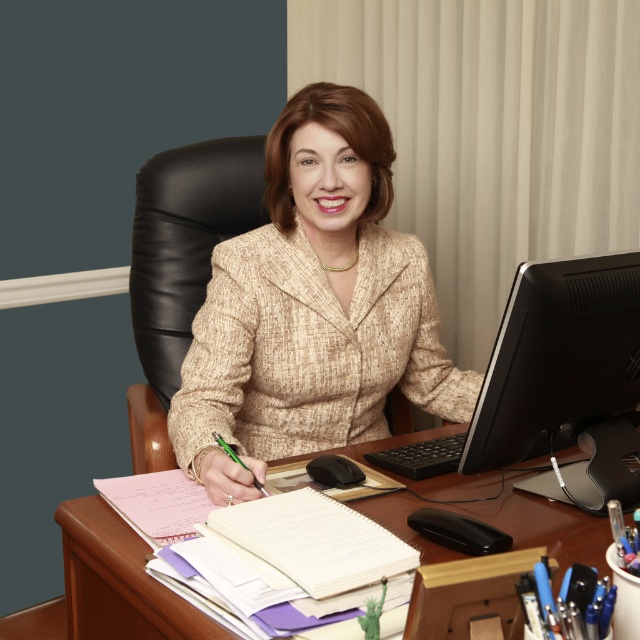
You are an office assistant who needs to organize the desk. The beige textured suit at center and wooden at center are both on the desk. Which item is located to the left of the other?

The beige textured suit at center is positioned on the left side of wooden at center, so the beige textured suit at center is to the left of the wooden at center.

You are an office worker who needs to locate the beige textured suit at center in the image. What are the coordinates where you should look?

The beige textured suit at center is located at coordinates point [312,307].